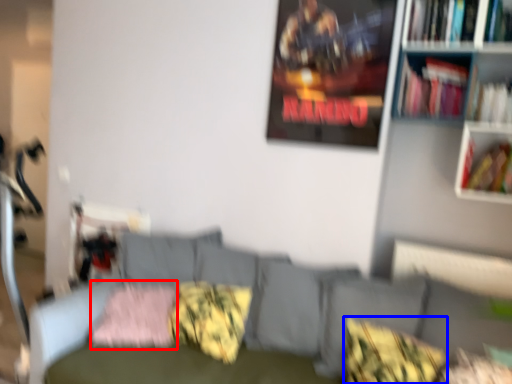
Question: Which object is further to the camera taking this photo, pillow (highlighted by a red box) or pillow (highlighted by a blue box)?

Choices:
 (A) pillow
 (B) pillow

Answer: (A)